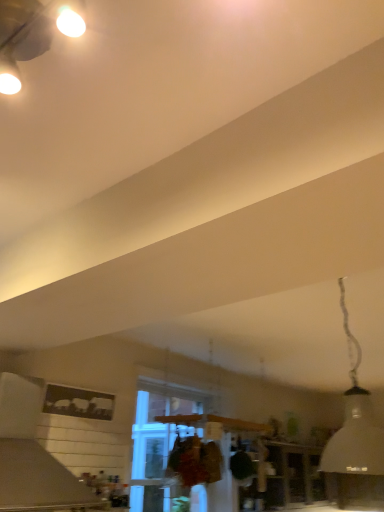
Question: From their relative heights in the image, would you say white matte lampshade at upper right is taller or shorter than clear glass window at center?

Choices:
 (A) tall
 (B) short

Answer: (B)

Question: From the image's perspective, relative to clear glass window at center, is white matte lampshade at upper right above or below?

Choices:
 (A) below
 (B) above

Answer: (B)

Question: Which of these objects is positioned closest to the white matte lampshade at upper right?

Choices:
 (A) clear glass window at center
 (B) white matte vent at upper left

Answer: (A)

Question: Based on their relative distances, which object is nearer to the white matte vent at upper left?

Choices:
 (A) white matte lampshade at upper right
 (B) clear glass window at center

Answer: (B)